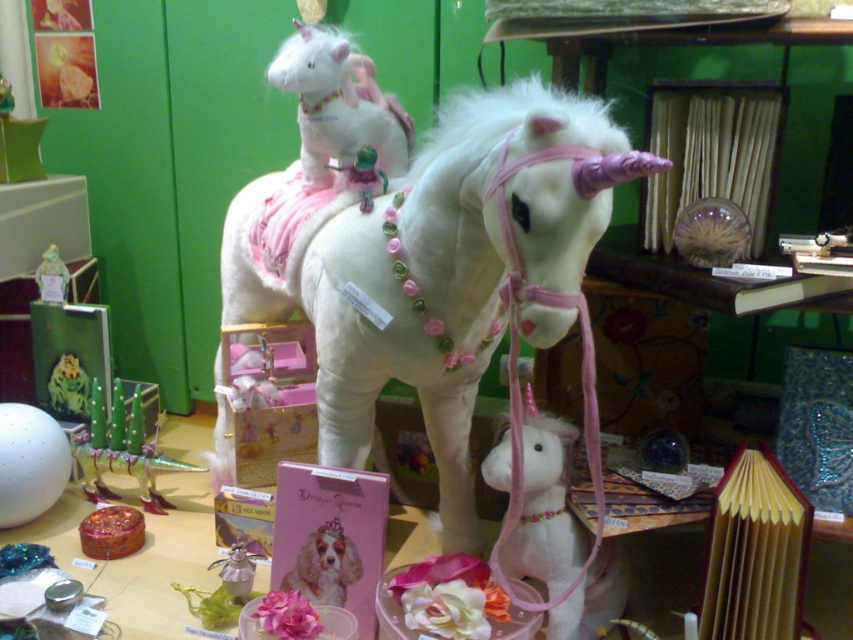
Between metallic silver toy at lower left and matte plastic unicorn at center, which one appears on the left side from the viewer's perspective?

matte plastic unicorn at center is more to the left.

Which is in front, point (143, 429) or point (53, 260)?

Point (143, 429)

You are a GUI agent. You are given a task and a screenshot of the screen. Output one action in this format:
    pyautogui.click(x=<x>, y=<y>)
    Task: Click on the metallic silver toy at lower left
    The image size is (853, 640).
    Given the screenshot: What is the action you would take?
    pyautogui.click(x=120, y=449)

Find the location of `metallic silver toy at lower left`. metallic silver toy at lower left is located at coordinates (120, 449).

Who is taller, white plush horse at center or matte plastic unicorn at center?

Standing taller between the two is white plush horse at center.

Is white plush horse at center taller than matte plastic unicorn at center?

Indeed, white plush horse at center has a greater height compared to matte plastic unicorn at center.

Does point (440, 138) lie in front of point (57, 262)?

Yes, it is.

The image size is (853, 640). I want to click on white plush horse at center, so click(433, 266).

Locate an element on the screen. metallic silver toy at lower left is located at coordinates (120, 449).

Can you confirm if metallic silver toy at lower left is positioned to the right of metallic silver figurine at center?

In fact, metallic silver toy at lower left is to the left of metallic silver figurine at center.

The width and height of the screenshot is (853, 640). What do you see at coordinates (120, 449) in the screenshot? I see `metallic silver toy at lower left` at bounding box center [120, 449].

I want to click on metallic silver toy at lower left, so (120, 449).